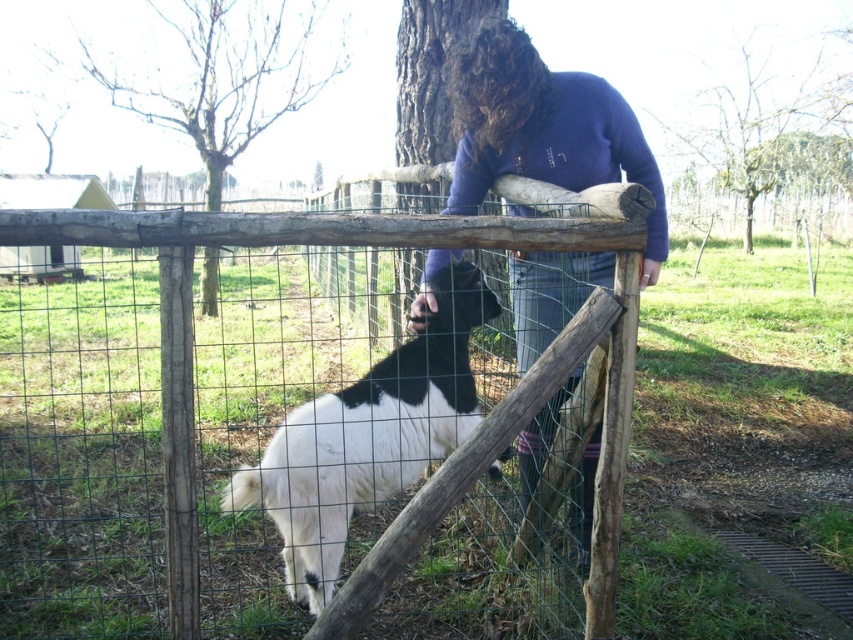
Question: Which object is the closest to the wooden fence at center?

Choices:
 (A) black and white fur at center
 (B) purple fleece sweater at center

Answer: (A)

Question: Can you confirm if wooden fence at center is positioned below black and white fur at center?

Choices:
 (A) no
 (B) yes

Answer: (A)

Question: Does wooden fence at center appear on the left side of purple fleece sweater at center?

Choices:
 (A) yes
 (B) no

Answer: (A)

Question: Among these points, which one is nearest to the camera?

Choices:
 (A) (x=524, y=284)
 (B) (x=624, y=458)

Answer: (B)

Question: Estimate the real-world distances between objects in this image. Which object is farther from the wooden fence at center?

Choices:
 (A) purple fleece sweater at center
 (B) black and white fur at center

Answer: (A)

Question: Is wooden fence at center positioned at the back of purple fleece sweater at center?

Choices:
 (A) no
 (B) yes

Answer: (A)